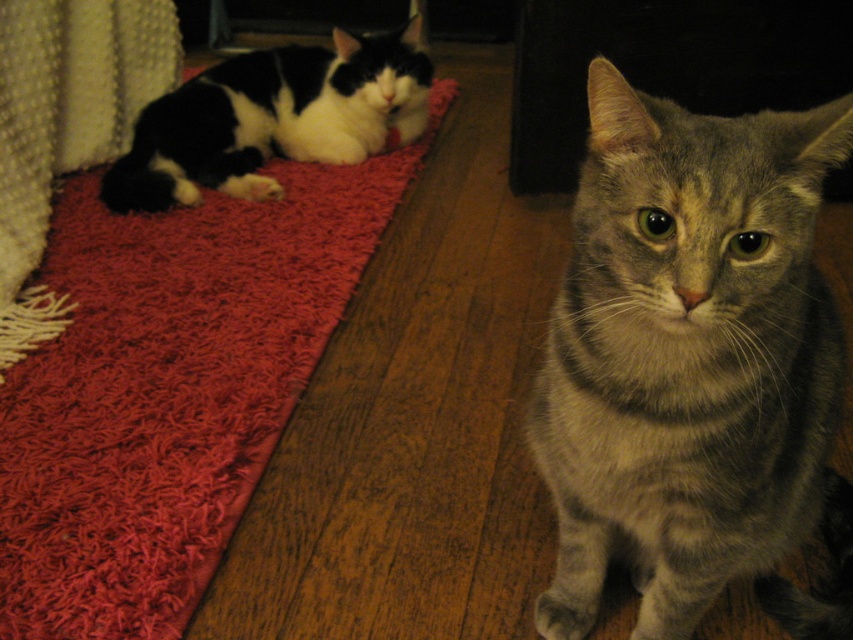
You are a cat owner who wants to place a new toy between the red shaggy rug at upper left and the black and white fur cat at upper left. The toy is 12 inches long. Will it fit between them without overlapping either?

The red shaggy rug at upper left and the black and white fur cat at upper left are 13.28 inches apart. Since the toy is 12 inches long, it will fit between them without overlapping either.

You are standing in the room where the gray tabby cat is sitting. If you walk straight ahead, will you reach the gray tabby cat before the point marked at coordinates (693,365)?

The point marked at coordinates (693,365) corresponds to the gray striped cat at center, so walking straight ahead would lead you directly to the gray tabby cat, meaning you would reach it before passing the specified point.

You are a photographer setting up a shot in this room. You need to position a light source to the left of the gray striped cat at center so it illuminates the red shaggy rug at upper left. Is the light source placement possible without moving the cat?

The gray striped cat at center is to the right of the red shaggy rug at upper left, so placing the light source to the left of the gray striped cat at center would still be to the right of the red shaggy rug at upper left. Therefore, the light source can be positioned there to illuminate the rug.